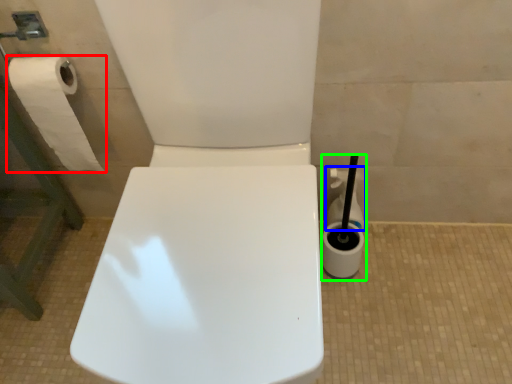
Question: Based on their relative distances, which object is nearer to toilet paper (highlighted by a red box)? Choose from cleaning product (highlighted by a blue box) and cleaning product (highlighted by a green box).

Choices:
 (A) cleaning product
 (B) cleaning product

Answer: (A)